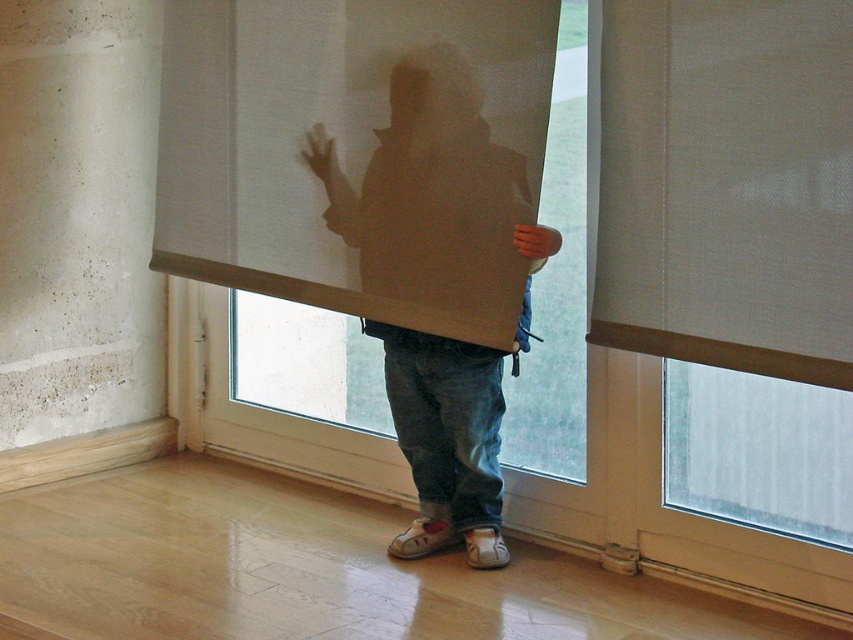
You are trying to decide whether to place a small plant on the matte cardboard box at center so it can get sunlight through the window. Based on the scene, will the beige fabric curtain at upper right block the sunlight from reaching the plant?

The beige fabric curtain at upper right is closer to the viewer than the matte cardboard box at center. Since the curtain is closer, it would block sunlight from reaching the matte cardboard box at center, so placing the plant there may not get enough light.

You are a decorator planning to hang a new curtain in the room. The white sheer curtain at center and beige fabric curtain at upper right are already present. Which curtain should you consider replacing if you want to install a larger curtain in the same spot?

The white sheer curtain at center has a larger size compared to the beige fabric curtain at upper right, so you should consider replacing the beige fabric curtain at upper right if you want to install a larger curtain in the same spot.

You are helping to organize a room and need to place a small plant on the floor. The plant requires indirect sunlight. Given the position of the white sheer curtain at center and the matte cardboard box at center, where should you place the plant to ensure it gets enough light?

The white sheer curtain at center is above the matte cardboard box at center, so placing the plant near the matte cardboard box at center would allow it to receive indirect sunlight filtering through the curtain.